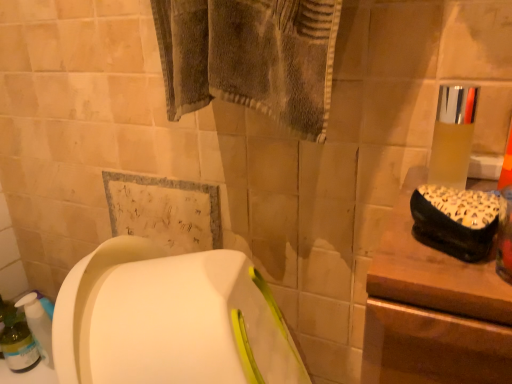
Question: Would you say translucent plastic bottle at lower left is to the left or to the right of translucent plastic cup at upper right in the picture?

Choices:
 (A) right
 (B) left

Answer: (B)

Question: Is translucent plastic bottle at lower left inside or outside of translucent plastic cup at upper right?

Choices:
 (A) inside
 (B) outside

Answer: (B)

Question: Does point (15, 327) appear closer or farther from the camera than point (462, 109)?

Choices:
 (A) closer
 (B) farther

Answer: (B)

Question: In the image, is translucent plastic cup at upper right on the left side or the right side of translucent plastic bottle at lower left?

Choices:
 (A) right
 (B) left

Answer: (A)

Question: From a real-world perspective, is translucent plastic cup at upper right physically located above or below translucent plastic bottle at lower left?

Choices:
 (A) above
 (B) below

Answer: (A)

Question: Does point (451, 142) appear closer or farther from the camera than point (14, 357)?

Choices:
 (A) farther
 (B) closer

Answer: (B)

Question: Considering their positions, is translucent plastic cup at upper right located in front of or behind translucent plastic bottle at lower left?

Choices:
 (A) front
 (B) behind

Answer: (A)